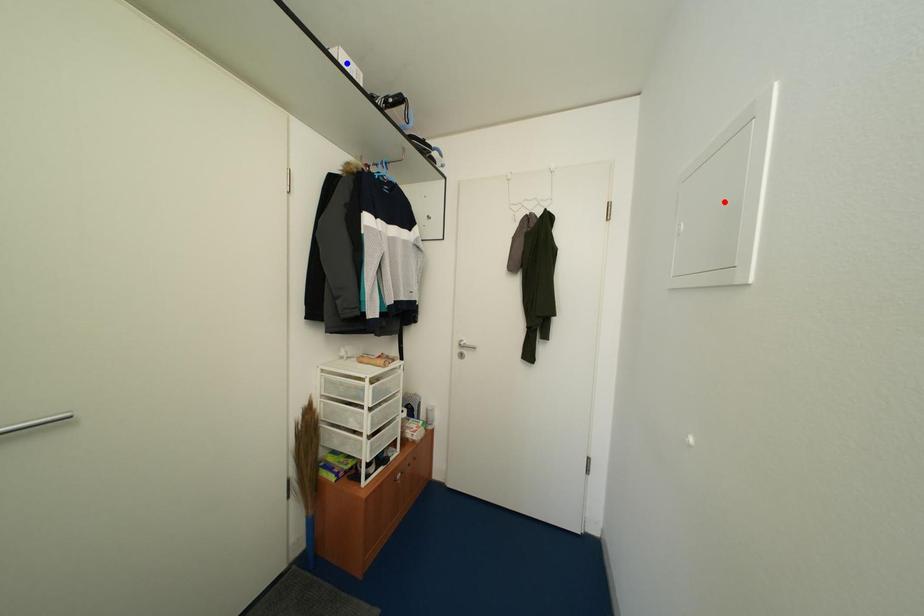
Question: In the image, two points are highlighted. Which point is nearer to the camera? Reply with the corresponding letter.

Choices:
 (A) blue point
 (B) red point

Answer: (B)